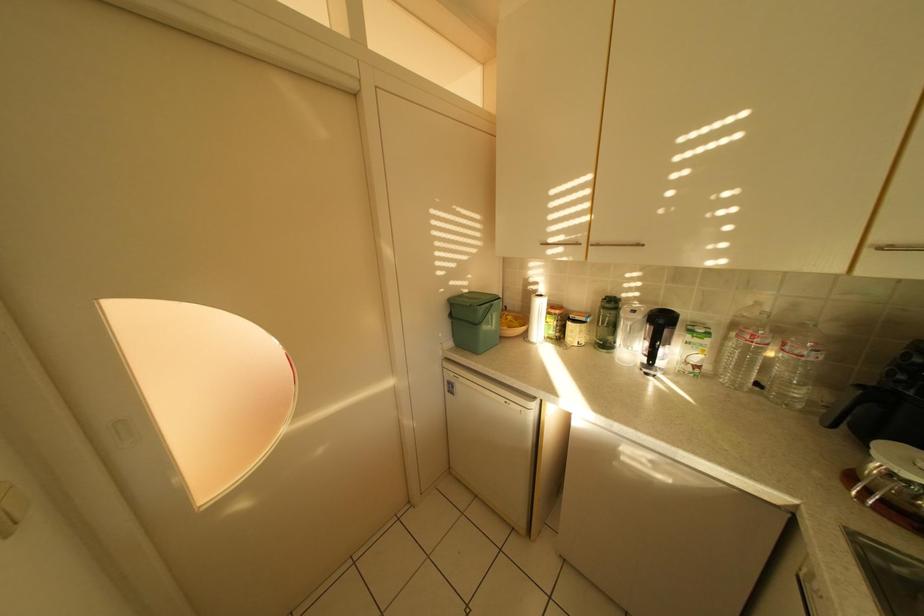
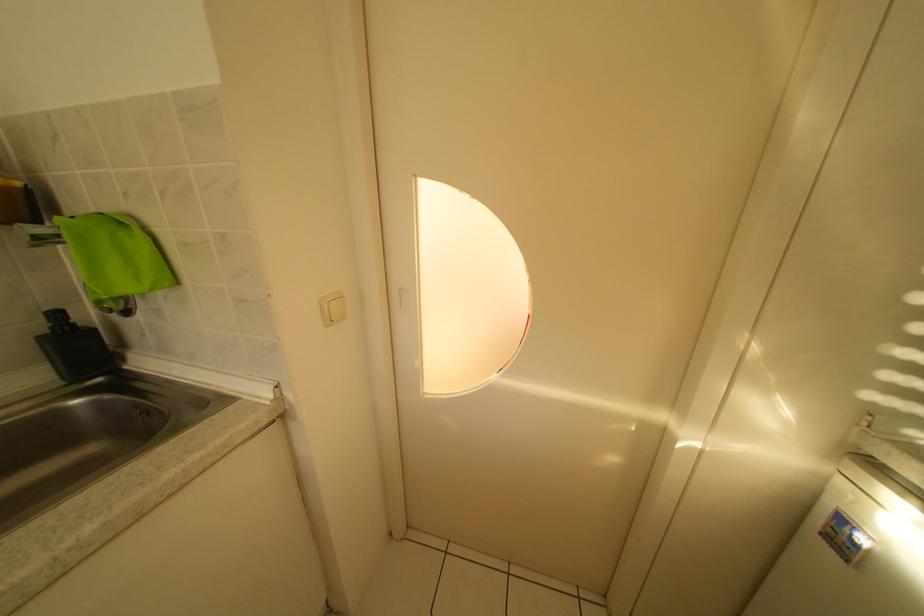
Question: The camera is either moving clockwise (left) or counter-clockwise (right) around the object. The first image is from the beginning of the video and the second image is from the end. Is the camera moving left or right when shooting the video?

Choices:
 (A) Left
 (B) Right

Answer: (B)